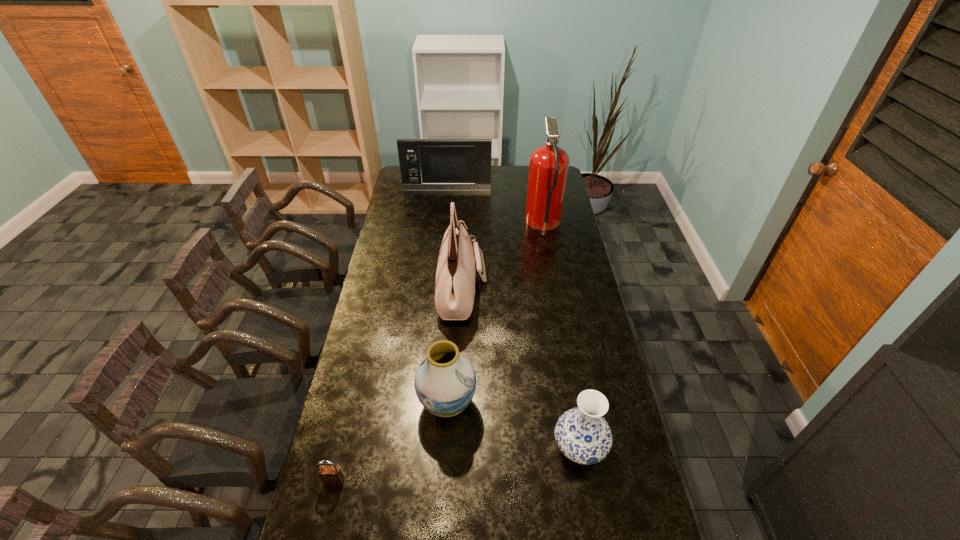
Identify the location of blank space that satisfies the following two spatial constraints: 1. with the handle and nozzle on the fire extinguisher; 2. on the front-facing side of the nearest object. (589, 480).

Find the location of `free spot that satisfies the following two spatial constraints: 1. with the handle and nozzle on the fire extinguisher; 2. on the front-facing side of the shortest object`. free spot that satisfies the following two spatial constraints: 1. with the handle and nozzle on the fire extinguisher; 2. on the front-facing side of the shortest object is located at coordinates (589, 480).

The image size is (960, 540). I want to click on free location that satisfies the following two spatial constraints: 1. on the front panel of the left vase; 2. on the left side of the farthest object, so click(x=425, y=403).